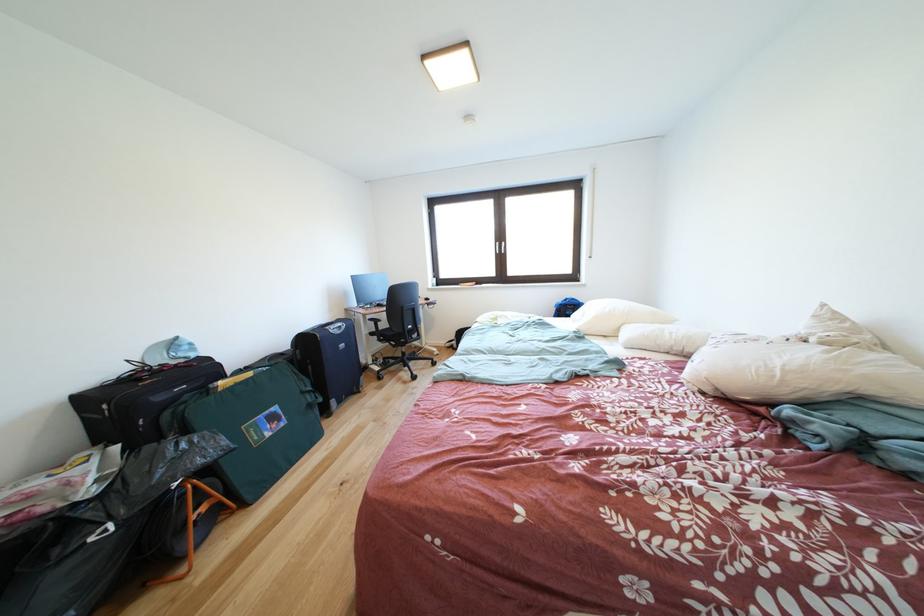
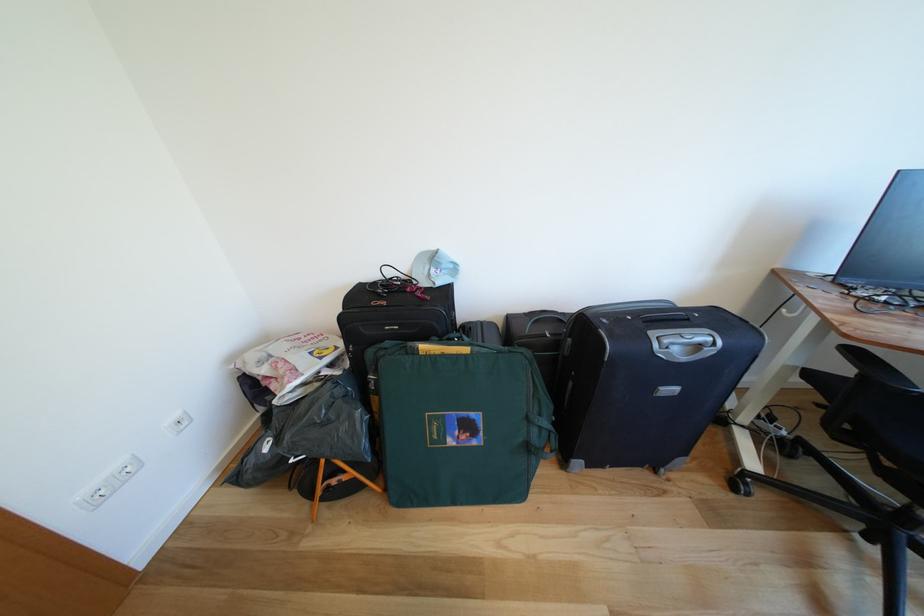
Locate, in the second image, the point that corresponds to (380,323) in the first image.

(862, 357)